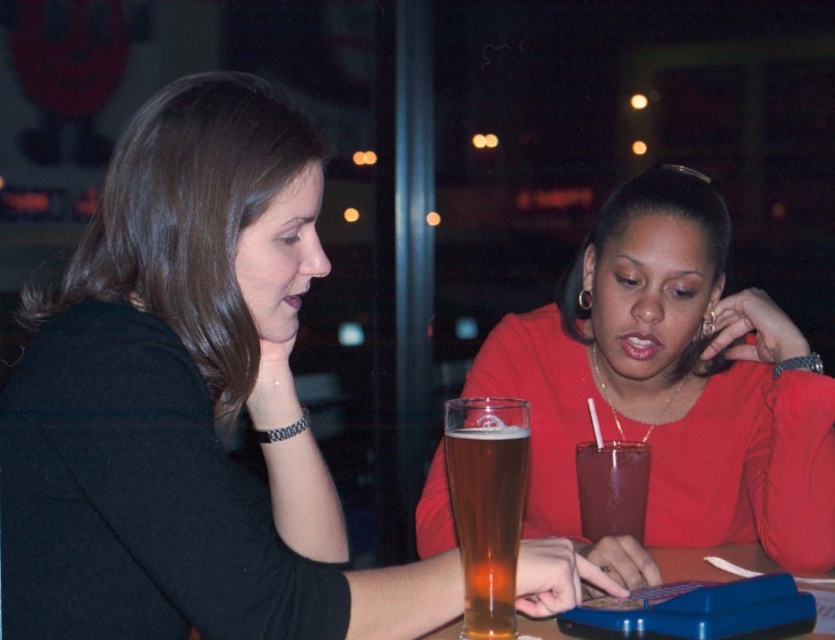
You are a waiter who needs to deliver a napkin to the customer at the table. The napkin is currently at the edge of the table, 12 inches away from the matte black shirt at center. Can you place the napkin closer to the golden glass beer at center without moving the shirt or the beer?

The matte black shirt at center is 8.05 inches away from the golden glass beer at center. Since the napkin is 12 inches away from the shirt, moving it towards the beer would require placing it within the existing 8.05 inches between them, which isn t possible without overlapping. Therefore, you cannot place the napkin closer to the golden glass beer at center without moving the shirt or the beer.